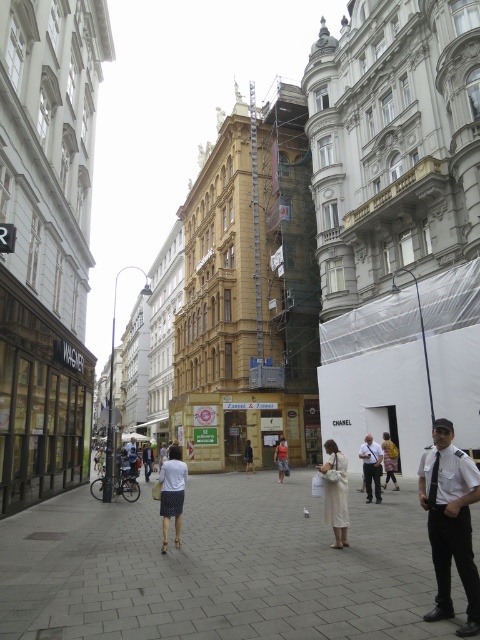
Can you confirm if white uniform at right is thinner than denim skirt at center?

Incorrect, white uniform at right's width is not less than denim skirt at center's.

Is white uniform at right positioned in front of denim skirt at center?

That is True.

This screenshot has height=640, width=480. I want to click on white uniform at right, so click(450, 522).

Is white cotton shirt at center below dark gray uniform at center?

No.

Is point (168, 456) in front of point (365, 500)?

Yes.

At what (x,y) coordinates should I click in order to perform the action: click on white cotton shirt at center. Please return your answer as a coordinate pair (x, y). This screenshot has height=640, width=480. Looking at the image, I should click on (171, 493).

Who is more distant from viewer, (457, 496) or (254, 468)?

The point (254, 468) is behind.

Can you confirm if white uniform at right is positioned to the right of dark brown leather jacket at center?

Yes, white uniform at right is to the right of dark brown leather jacket at center.

Who is more forward, [437,496] or [245,451]?

Point [437,496] is more forward.

This screenshot has height=640, width=480. Identify the location of white uniform at right. (450, 522).